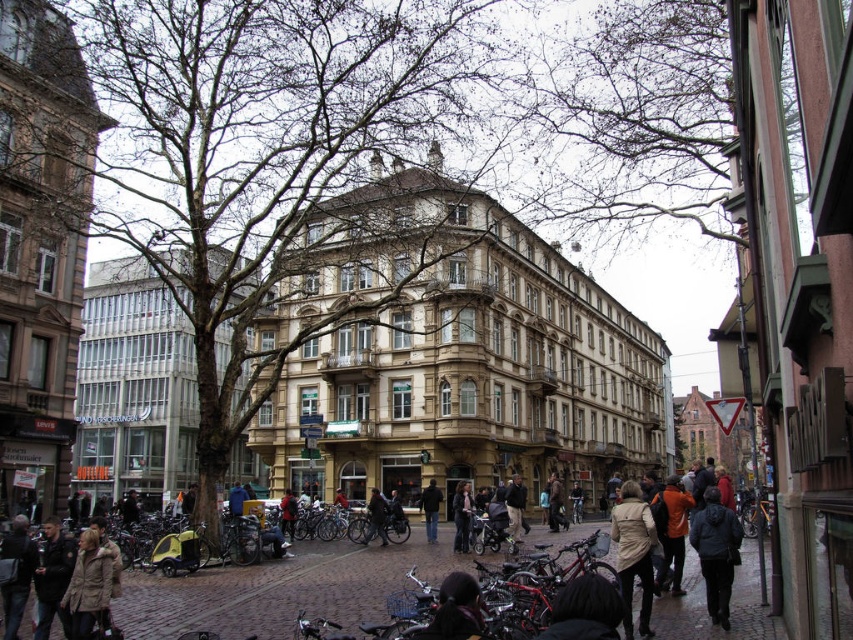
Question: Which is nearer to the shiny chrome motorcycle at center?

Choices:
 (A) dark gray jacket at center
 (B) dark blue jeans at center
 (C) dark gray jacket at lower left
 (D) khaki fabric jacket at lower left

Answer: (A)

Question: Can you confirm if khaki fabric jacket at lower left is positioned above dark blue jeans at center?

Choices:
 (A) yes
 (B) no

Answer: (A)

Question: In this image, where is dark brown leather jacket at lower left located relative to dark gray jacket at lower left?

Choices:
 (A) below
 (B) above

Answer: (A)

Question: Which of the following is the farthest from the observer?

Choices:
 (A) dark brown hair at lower center
 (B) dark blue jeans at center
 (C) dark brown leather jacket at lower center

Answer: (B)

Question: Considering the real-world distances, which object is farthest from the dark gray jacket at lower left?

Choices:
 (A) dark brown leather jacket at lower center
 (B) dark brown hair at lower center

Answer: (A)

Question: Is khaki fabric jacket at lower left smaller than shiny chrome motorcycle at center?

Choices:
 (A) no
 (B) yes

Answer: (A)